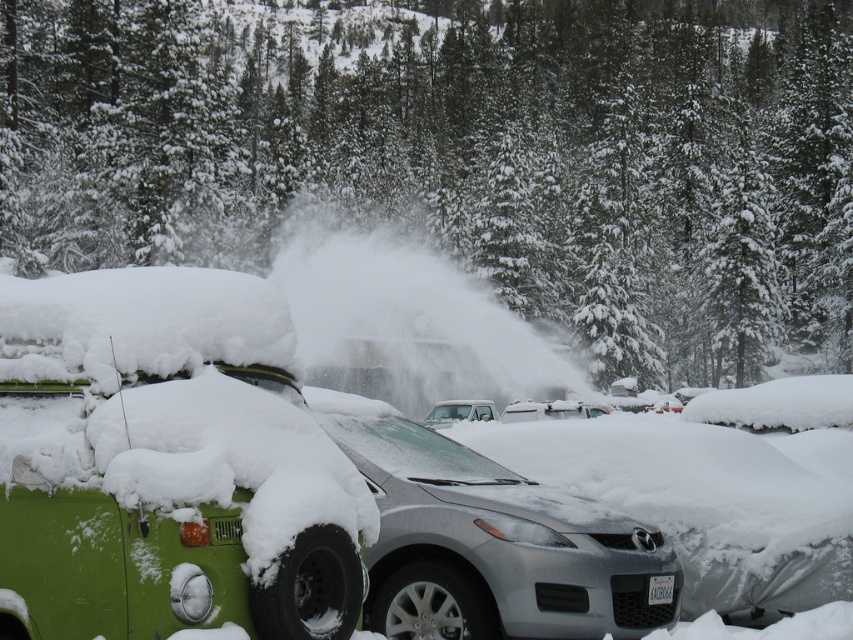
Can you confirm if green matte van at left is positioned to the right of white plastic license plate at center?

No, green matte van at left is not to the right of white plastic license plate at center.

Who is positioned more to the right, green matte van at left or white plastic license plate at center?

Positioned to the right is white plastic license plate at center.

Is point (242, 628) less distant than point (666, 582)?

Yes, point (242, 628) is in front of point (666, 582).

Identify the location of green matte van at left. The image size is (853, 640). pos(181,470).

Can you confirm if green matte van at left is positioned below white matte truck at center?

No.

Is green matte van at left behind white matte truck at center?

No, green matte van at left is closer to the viewer.

The width and height of the screenshot is (853, 640). Find the location of `green matte van at left`. green matte van at left is located at coordinates (181, 470).

Is point (462, 400) closer to viewer compared to point (665, 596)?

No, (462, 400) is further to viewer.

The width and height of the screenshot is (853, 640). Identify the location of white matte truck at center. (459, 412).